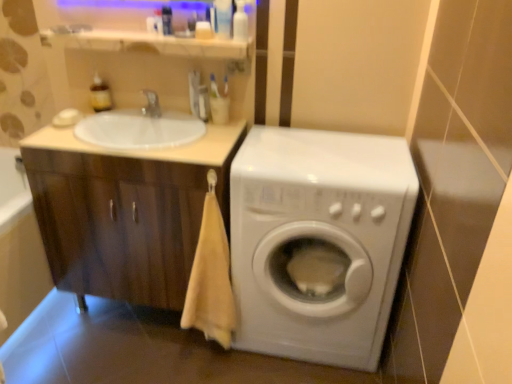
Where is `vacant space situated on the left part of translucent plastic toothbrush at upper center, which is counted as the fourth toiletry, starting from the right`? The height and width of the screenshot is (384, 512). vacant space situated on the left part of translucent plastic toothbrush at upper center, which is counted as the fourth toiletry, starting from the right is located at coordinates (172, 122).